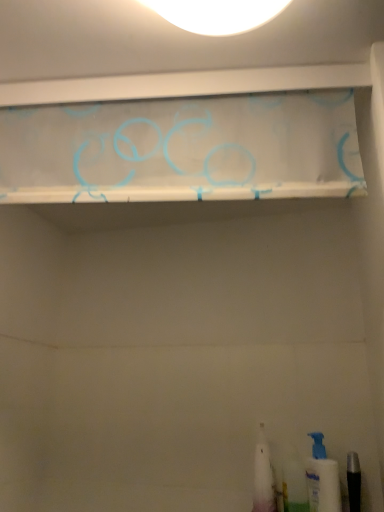
Measure the distance between point (314, 100) and camera.

A distance of 31.57 inches exists between point (314, 100) and camera.

Where is `translucent plastic toothbrush at lower right, the second toiletry viewed from the right`? The image size is (384, 512). translucent plastic toothbrush at lower right, the second toiletry viewed from the right is located at coordinates (294, 482).

In order to face white plastic pump bottle at lower right, acting as the 3th toiletry starting from the left, should I rotate leftwards or rightwards?

You should rotate right by 17.369 degrees.

How much space does white plastic pump bottle at lower right, acting as the 3th toiletry starting from the left, occupy horizontally?

white plastic pump bottle at lower right, acting as the 3th toiletry starting from the left, is 4.09 inches in width.

This screenshot has height=512, width=384. I want to click on translucent fabric curtain at upper center, so click(182, 149).

Based on the photo, does translucent fabric curtain at upper center turn towards white plastic toothbrush at lower right, positioned as the 3th toiletry in right-to-left order?

No, translucent fabric curtain at upper center does not turn towards white plastic toothbrush at lower right, positioned as the 3th toiletry in right-to-left order.

Image resolution: width=384 pixels, height=512 pixels. In order to click on shelf that appears on the left of white plastic toothbrush at lower right, the 1th toiletry in the left-to-right sequence in this screenshot , I will do `click(182, 149)`.

Considering the positions of objects translucent fabric curtain at upper center and white plastic toothbrush at lower right, the 1th toiletry in the left-to-right sequence, in the image provided, who is more to the right, translucent fabric curtain at upper center or white plastic toothbrush at lower right, the 1th toiletry in the left-to-right sequence,?

From the viewer's perspective, white plastic toothbrush at lower right, the 1th toiletry in the left-to-right sequence, appears more on the right side.

Is white plastic toothbrush at lower right, positioned as the 3th toiletry in right-to-left order, shorter than white plastic pump bottle at lower right, the first toiletry when ordered from right to left?

In fact, white plastic toothbrush at lower right, positioned as the 3th toiletry in right-to-left order, may be taller than white plastic pump bottle at lower right, the first toiletry when ordered from right to left.

Find the location of a particular element. This screenshot has width=384, height=512. toiletry that is the 2nd object to the left of the white plastic pump bottle at lower right, the first toiletry when ordered from right to left, starting at the anchor is located at coordinates (263, 476).

From a real-world perspective, is white plastic toothbrush at lower right, the 1th toiletry in the left-to-right sequence, above or below white plastic pump bottle at lower right, acting as the 3th toiletry starting from the left?

In terms of real-world spatial position, white plastic toothbrush at lower right, the 1th toiletry in the left-to-right sequence, is above white plastic pump bottle at lower right, acting as the 3th toiletry starting from the left.

Can you confirm if white plastic pump bottle at lower right, the first toiletry when ordered from right to left, is positioned to the right of translucent fabric curtain at upper center?

Result: Yes, white plastic pump bottle at lower right, the first toiletry when ordered from right to left, is to the right of translucent fabric curtain at upper center.

How far apart are white plastic pump bottle at lower right, acting as the 3th toiletry starting from the left, and translucent fabric curtain at upper center?

A distance of 33.38 inches exists between white plastic pump bottle at lower right, acting as the 3th toiletry starting from the left, and translucent fabric curtain at upper center.

From the image's perspective, is white plastic pump bottle at lower right, the first toiletry when ordered from right to left, below translucent fabric curtain at upper center?

Yes, from the image's perspective, white plastic pump bottle at lower right, the first toiletry when ordered from right to left, is beneath translucent fabric curtain at upper center.

Would you consider white plastic pump bottle at lower right, acting as the 3th toiletry starting from the left, to be distant from translucent fabric curtain at upper center?

No, there isn't a large distance between white plastic pump bottle at lower right, acting as the 3th toiletry starting from the left, and translucent fabric curtain at upper center.

In terms of width, does white plastic pump bottle at lower right, the first toiletry when ordered from right to left, look wider or thinner when compared to translucent plastic toothbrush at lower right, the second toiletry viewed from the right?

In the image, white plastic pump bottle at lower right, the first toiletry when ordered from right to left, appears to be more narrow than translucent plastic toothbrush at lower right, the second toiletry viewed from the right.

Relative to translucent plastic toothbrush at lower right, the second toiletry in the left-to-right sequence, is white plastic pump bottle at lower right, the first toiletry when ordered from right to left, in front or behind?

Clearly, white plastic pump bottle at lower right, the first toiletry when ordered from right to left, is in front of translucent plastic toothbrush at lower right, the second toiletry in the left-to-right sequence.

Is translucent plastic toothbrush at lower right, the second toiletry viewed from the right, closer to camera compared to white plastic toothbrush at lower right, the 1th toiletry in the left-to-right sequence?

Yes, translucent plastic toothbrush at lower right, the second toiletry viewed from the right, is closer to the viewer.

Could you measure the distance between translucent plastic toothbrush at lower right, the second toiletry viewed from the right, and white plastic toothbrush at lower right, the 1th toiletry in the left-to-right sequence?

translucent plastic toothbrush at lower right, the second toiletry viewed from the right, is 2.19 inches away from white plastic toothbrush at lower right, the 1th toiletry in the left-to-right sequence.

Is point (304, 489) behind point (262, 441)?

No, it is in front of (262, 441).

Is white plastic toothbrush at lower right, positioned as the 3th toiletry in right-to-left order, surrounded by translucent plastic toothbrush at lower right, the second toiletry in the left-to-right sequence?

Definitely not — white plastic toothbrush at lower right, positioned as the 3th toiletry in right-to-left order, is not inside translucent plastic toothbrush at lower right, the second toiletry in the left-to-right sequence.

At what (x,y) coordinates should I click in order to perform the action: click on toiletry that is the 1st object located below the white plastic pump bottle at lower right, the first toiletry when ordered from right to left (from the image's perspective). Please return your answer as a coordinate pair (x, y). The height and width of the screenshot is (512, 384). Looking at the image, I should click on (263, 476).

Is the surface of white plastic pump bottle at lower right, the first toiletry when ordered from right to left, in direct contact with white plastic toothbrush at lower right, positioned as the 3th toiletry in right-to-left order?

No, white plastic pump bottle at lower right, the first toiletry when ordered from right to left, is not in contact with white plastic toothbrush at lower right, positioned as the 3th toiletry in right-to-left order.

Can you confirm if white plastic pump bottle at lower right, acting as the 3th toiletry starting from the left, is positioned to the right of white plastic toothbrush at lower right, the 1th toiletry in the left-to-right sequence?

Yes.

How many degrees apart are the facing directions of white plastic pump bottle at lower right, acting as the 3th toiletry starting from the left, and white plastic toothbrush at lower right, positioned as the 3th toiletry in right-to-left order?

The facing directions of white plastic pump bottle at lower right, acting as the 3th toiletry starting from the left, and white plastic toothbrush at lower right, positioned as the 3th toiletry in right-to-left order, are 0.00234 degrees apart.

Can you confirm if translucent plastic toothbrush at lower right, the second toiletry in the left-to-right sequence, is thinner than translucent fabric curtain at upper center?

Incorrect, the width of translucent plastic toothbrush at lower right, the second toiletry in the left-to-right sequence, is not less than that of translucent fabric curtain at upper center.

Is translucent plastic toothbrush at lower right, the second toiletry viewed from the right, not inside translucent fabric curtain at upper center?

Yes, translucent plastic toothbrush at lower right, the second toiletry viewed from the right, is outside of translucent fabric curtain at upper center.

Relative to translucent fabric curtain at upper center, is translucent plastic toothbrush at lower right, the second toiletry in the left-to-right sequence, in front or behind?

Clearly, translucent plastic toothbrush at lower right, the second toiletry in the left-to-right sequence, is behind translucent fabric curtain at upper center.

Would you consider translucent plastic toothbrush at lower right, the second toiletry viewed from the right, to be distant from translucent fabric curtain at upper center?

No, translucent plastic toothbrush at lower right, the second toiletry viewed from the right, is not far away from translucent fabric curtain at upper center.

Locate an element on the screen. shelf lying in front of the white plastic toothbrush at lower right, positioned as the 3th toiletry in right-to-left order is located at coordinates (182, 149).

Where is `toiletry above the white plastic toothbrush at lower right, the 1th toiletry in the left-to-right sequence (from the image's perspective)`? toiletry above the white plastic toothbrush at lower right, the 1th toiletry in the left-to-right sequence (from the image's perspective) is located at coordinates (322, 478).

Looking at the image, which one is located closer to translucent plastic toothbrush at lower right, the second toiletry in the left-to-right sequence, translucent fabric curtain at upper center or white plastic pump bottle at lower right, acting as the 3th toiletry starting from the left?

The object closer to translucent plastic toothbrush at lower right, the second toiletry in the left-to-right sequence, is white plastic pump bottle at lower right, acting as the 3th toiletry starting from the left.

From the image, which object appears to be farther from white plastic toothbrush at lower right, positioned as the 3th toiletry in right-to-left order, translucent fabric curtain at upper center or translucent plastic toothbrush at lower right, the second toiletry in the left-to-right sequence?

Among the two, translucent fabric curtain at upper center is located further to white plastic toothbrush at lower right, positioned as the 3th toiletry in right-to-left order.

Looking at the image, which one is located further to white plastic toothbrush at lower right, the 1th toiletry in the left-to-right sequence, white plastic pump bottle at lower right, acting as the 3th toiletry starting from the left, or translucent plastic toothbrush at lower right, the second toiletry in the left-to-right sequence?

white plastic pump bottle at lower right, acting as the 3th toiletry starting from the left, is positioned further to the anchor white plastic toothbrush at lower right, the 1th toiletry in the left-to-right sequence.

Which object lies nearer to the anchor point white plastic pump bottle at lower right, the first toiletry when ordered from right to left, translucent plastic toothbrush at lower right, the second toiletry viewed from the right, or translucent fabric curtain at upper center?

The object closer to white plastic pump bottle at lower right, the first toiletry when ordered from right to left, is translucent plastic toothbrush at lower right, the second toiletry viewed from the right.

Looking at the image, which one is located further to white plastic pump bottle at lower right, acting as the 3th toiletry starting from the left, white plastic toothbrush at lower right, the 1th toiletry in the left-to-right sequence, or translucent plastic toothbrush at lower right, the second toiletry viewed from the right?

Among the two, white plastic toothbrush at lower right, the 1th toiletry in the left-to-right sequence, is located further to white plastic pump bottle at lower right, acting as the 3th toiletry starting from the left.

Based on their spatial positions, is translucent plastic toothbrush at lower right, the second toiletry viewed from the right, or white plastic toothbrush at lower right, the 1th toiletry in the left-to-right sequence, further from white plastic pump bottle at lower right, acting as the 3th toiletry starting from the left?

white plastic toothbrush at lower right, the 1th toiletry in the left-to-right sequence, is positioned further to the anchor white plastic pump bottle at lower right, acting as the 3th toiletry starting from the left.

Looking at the image, which one is located further to translucent fabric curtain at upper center, white plastic pump bottle at lower right, the first toiletry when ordered from right to left, or translucent plastic toothbrush at lower right, the second toiletry viewed from the right?

Among the two, translucent plastic toothbrush at lower right, the second toiletry viewed from the right, is located further to translucent fabric curtain at upper center.

Looking at the image, which one is located further to translucent fabric curtain at upper center, white plastic toothbrush at lower right, positioned as the 3th toiletry in right-to-left order, or white plastic pump bottle at lower right, the first toiletry when ordered from right to left?

Based on the image, white plastic pump bottle at lower right, the first toiletry when ordered from right to left, appears to be further to translucent fabric curtain at upper center.

Where is `toiletry located between white plastic toothbrush at lower right, positioned as the 3th toiletry in right-to-left order, and white plastic pump bottle at lower right, the first toiletry when ordered from right to left, in the left-right direction`? toiletry located between white plastic toothbrush at lower right, positioned as the 3th toiletry in right-to-left order, and white plastic pump bottle at lower right, the first toiletry when ordered from right to left, in the left-right direction is located at coordinates (294, 482).

Find the location of a particular element. toiletry between translucent fabric curtain at upper center and white plastic toothbrush at lower right, positioned as the 3th toiletry in right-to-left order, vertically is located at coordinates (322, 478).